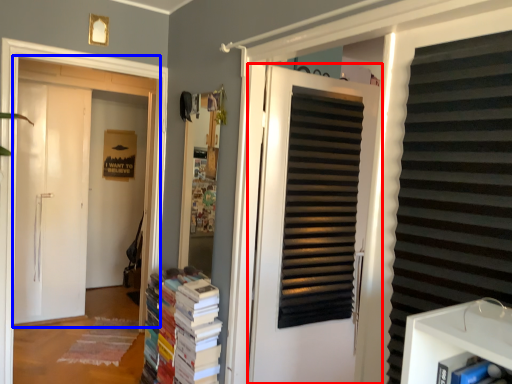
Question: Among these objects, which one is farthest to the camera, door (highlighted by a red box) or door (highlighted by a blue box)?

Choices:
 (A) door
 (B) door

Answer: (B)